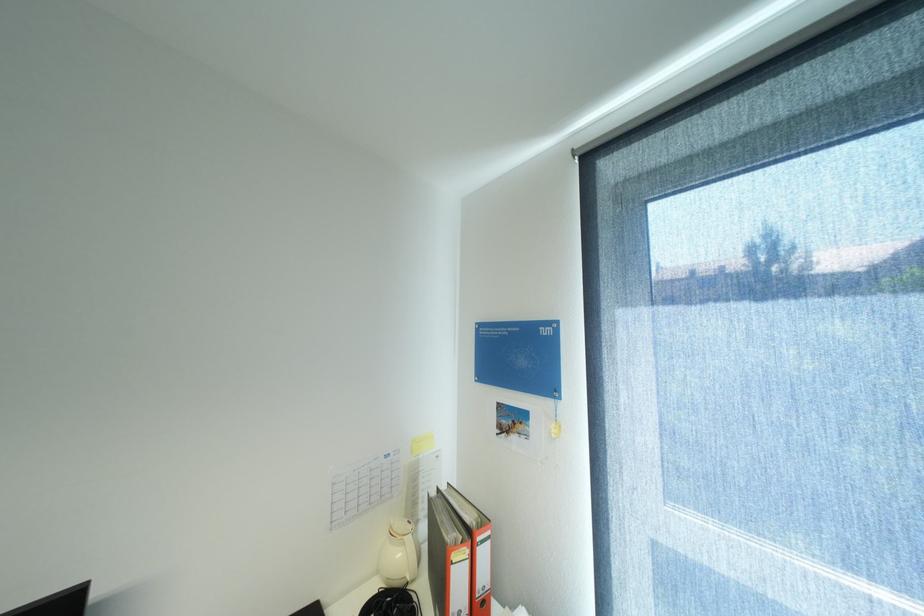
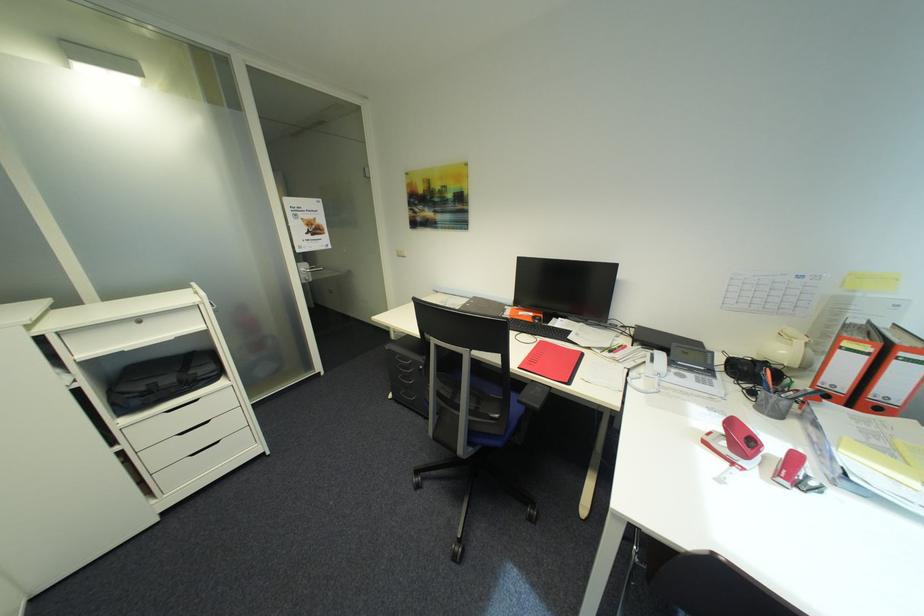
Locate, in the second image, the point that corresponds to the point at 476,565 in the first image.

(872, 359)